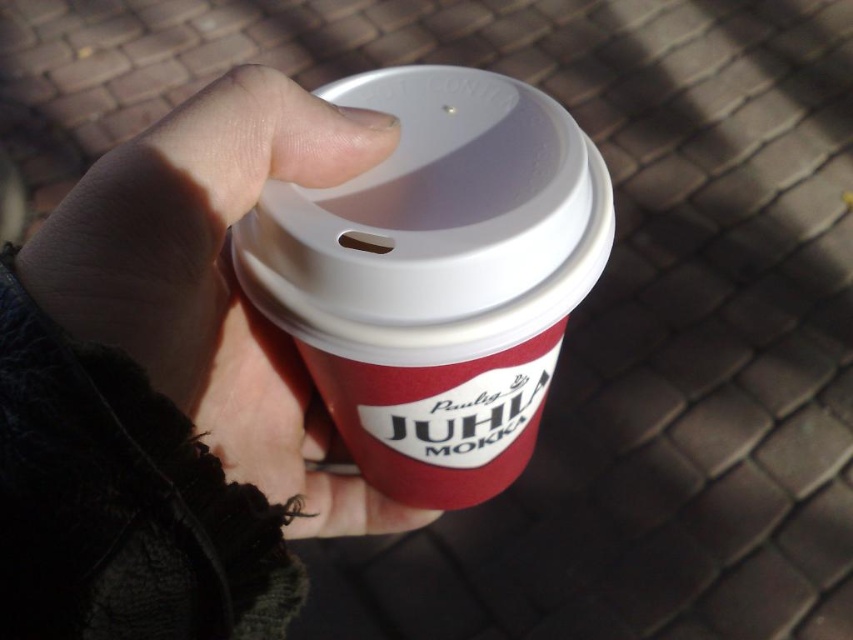
Question: Which point is closer to the camera taking this photo?

Choices:
 (A) (531, 388)
 (B) (85, 212)

Answer: (B)

Question: Is matte plastic cup at center to the right of smooth leather glove at center from the viewer's perspective?

Choices:
 (A) no
 (B) yes

Answer: (B)

Question: Can you confirm if matte plastic cup at center is wider than smooth leather glove at center?

Choices:
 (A) yes
 (B) no

Answer: (A)

Question: Is matte plastic cup at center further to camera compared to smooth leather glove at center?

Choices:
 (A) yes
 (B) no

Answer: (A)

Question: Which of the following is the farthest from the observer?

Choices:
 (A) (491, 376)
 (B) (41, 260)

Answer: (A)